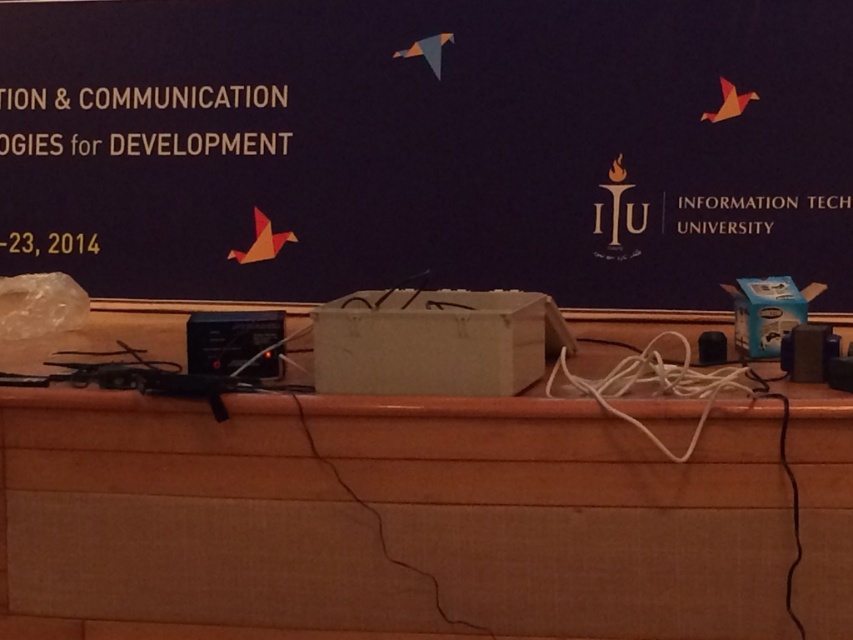
What is located at the point marked by the coordinates (x=428, y=145) on the stage?

The point marked by the coordinates (x=428, y=145) on the stage is where the matte cardboard bulletin board at center is located.

You are an event organizer setting up for a presentation. You need to place a large poster on the matte cardboard bulletin board at center and a laptop on the wooden table at center. However, the bulletin board is covering part of the table. Can you place both items without moving the bulletin board?

The matte cardboard bulletin board at center is positioned over the wooden table at center, so placing the laptop on the uncovered part of the wooden table at center would allow both items to be placed without moving the bulletin board.

You are organizing an event and need to place a large poster on the matte cardboard bulletin board at center or the wooden table at center. Which object can accommodate the poster better based on their sizes?

The matte cardboard bulletin board at center has a larger size compared to the wooden table at center, so it can accommodate the large poster better.